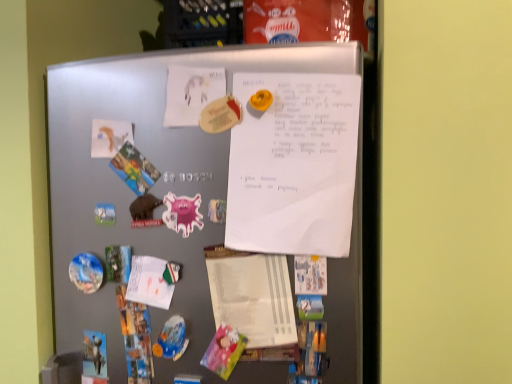
What do you see at coordinates (294, 164) in the screenshot? I see `white paper at upper center, the first poster positioned from the right` at bounding box center [294, 164].

This screenshot has height=384, width=512. In order to click on pink glossy magnet at center-left in this screenshot , I will do `click(182, 213)`.

The width and height of the screenshot is (512, 384). Find the location of `white paper notepad at center`. white paper notepad at center is located at coordinates pos(253,297).

You are a GUI agent. You are given a task and a screenshot of the screen. Output one action in this format:
    pyautogui.click(x=<x>, y=<y>)
    Task: Click on the white matte paper at upper left
    
    Given the screenshot: What is the action you would take?
    pyautogui.click(x=110, y=137)

Choose the correct answer: Is matte paper poster at upper center, the 2th poster when ordered from right to left, inside pink glossy magnet at center-left or outside it?

matte paper poster at upper center, the 2th poster when ordered from right to left, is located beyond the bounds of pink glossy magnet at center-left.

Does matte paper poster at upper center, the 2th poster when ordered from right to left, come in front of pink glossy magnet at center-left?

Yes, it is in front of pink glossy magnet at center-left.

Based on their positions, is matte paper poster at upper center, the 2th poster when ordered from right to left, located to the left or right of pink glossy magnet at center-left?

Based on their positions, matte paper poster at upper center, the 2th poster when ordered from right to left, is located to the right of pink glossy magnet at center-left.

Is matte paper poster at upper center, the 2th poster when ordered from right to left, positioned far away from pink glossy magnet at center-left?

No, matte paper poster at upper center, the 2th poster when ordered from right to left, is not far away from pink glossy magnet at center-left.

From the image's perspective, is pink glossy magnet at center-left above or below white paper notepad at center?

Clearly, from the image's perspective, pink glossy magnet at center-left is above white paper notepad at center.

Is pink glossy magnet at center-left inside or outside of white paper notepad at center?

pink glossy magnet at center-left is spatially situated outside white paper notepad at center.

Consider the image. Is pink glossy magnet at center-left next to white paper notepad at center?

There is a gap between pink glossy magnet at center-left and white paper notepad at center.

Is pink glossy magnet at center-left thinner than white paper notepad at center?

Correct, the width of pink glossy magnet at center-left is less than that of white paper notepad at center.

Considering the relative sizes of matte paper poster at upper center, the 2th poster when ordered from right to left, and white paper at upper center, placed as the 2th poster when sorted from left to right, in the image provided, is matte paper poster at upper center, the 2th poster when ordered from right to left, thinner than white paper at upper center, placed as the 2th poster when sorted from left to right,?

Yes.

Considering the sizes of matte paper poster at upper center, positioned as the 1th poster in left-to-right order, and white paper at upper center, the first poster positioned from the right, in the image, is matte paper poster at upper center, positioned as the 1th poster in left-to-right order, taller or shorter than white paper at upper center, the first poster positioned from the right,?

Clearly, matte paper poster at upper center, positioned as the 1th poster in left-to-right order, is shorter compared to white paper at upper center, the first poster positioned from the right.

The height and width of the screenshot is (384, 512). In order to click on poster that is in front of the matte paper poster at upper center, positioned as the 1th poster in left-to-right order in this screenshot , I will do `click(294, 164)`.

Are satin silver refrigerator at center and matte paper poster at upper center, positioned as the 1th poster in left-to-right order, making contact?

→ No, satin silver refrigerator at center is not beside matte paper poster at upper center, positioned as the 1th poster in left-to-right order.

From the image's perspective, which one is positioned higher, satin silver refrigerator at center or matte paper poster at upper center, positioned as the 1th poster in left-to-right order?

matte paper poster at upper center, positioned as the 1th poster in left-to-right order, appears higher in the image.

Between satin silver refrigerator at center and matte paper poster at upper center, the 2th poster when ordered from right to left, which one has larger size?

satin silver refrigerator at center.

What's the angular difference between satin silver refrigerator at center and matte paper poster at upper center, positioned as the 1th poster in left-to-right order,'s facing directions?

The facing directions of satin silver refrigerator at center and matte paper poster at upper center, positioned as the 1th poster in left-to-right order, are 0.899 degrees apart.

Does white paper notepad at center lie behind pink glossy magnet at center-left?

No, white paper notepad at center is closer to the viewer.

Which is more to the left, white paper notepad at center or pink glossy magnet at center-left?

pink glossy magnet at center-left.

Considering the sizes of white paper notepad at center and pink glossy magnet at center-left in the image, is white paper notepad at center taller or shorter than pink glossy magnet at center-left?

In the image, white paper notepad at center appears to be taller than pink glossy magnet at center-left.

Between white paper at upper center, the first poster positioned from the right, and satin silver refrigerator at center, which one is positioned behind?

white paper at upper center, the first poster positioned from the right, is further from the camera.

Which of these two, white paper at upper center, placed as the 2th poster when sorted from left to right, or satin silver refrigerator at center, is wider?

satin silver refrigerator at center is wider.

Does white paper at upper center, the first poster positioned from the right, touch satin silver refrigerator at center?

white paper at upper center, the first poster positioned from the right, and satin silver refrigerator at center are clearly separated.

Is white paper at upper center, placed as the 2th poster when sorted from left to right, surrounding satin silver refrigerator at center?

No, satin silver refrigerator at center is not inside white paper at upper center, placed as the 2th poster when sorted from left to right.

Is white matte paper at upper left looking in the opposite direction of white paper at upper center, placed as the 2th poster when sorted from left to right?

No, white matte paper at upper left is not facing away from white paper at upper center, placed as the 2th poster when sorted from left to right.

Between white matte paper at upper left and white paper at upper center, placed as the 2th poster when sorted from left to right, which one is positioned in front?

white paper at upper center, placed as the 2th poster when sorted from left to right, is in front.

From the image's perspective, is white matte paper at upper left on top of white paper at upper center, placed as the 2th poster when sorted from left to right?

Yes, from the image's perspective, white matte paper at upper left is on top of white paper at upper center, placed as the 2th poster when sorted from left to right.

Where is `art on the left of matte paper poster at upper center, positioned as the 1th poster in left-to-right order`? art on the left of matte paper poster at upper center, positioned as the 1th poster in left-to-right order is located at coordinates (182, 213).

You are a GUI agent. You are given a task and a screenshot of the screen. Output one action in this format:
    pyautogui.click(x=<x>, y=<y>)
    Task: Click on the art above the white paper notepad at center (from a real-world perspective)
    
    Given the screenshot: What is the action you would take?
    pyautogui.click(x=182, y=213)

Based on their spatial positions, is white paper notepad at center or matte paper poster at upper center, the 2th poster when ordered from right to left, closer to white paper at upper center, placed as the 2th poster when sorted from left to right?

white paper notepad at center lies closer to white paper at upper center, placed as the 2th poster when sorted from left to right, than the other object.

Based on their spatial positions, is white matte paper at upper left or pink glossy magnet at center-left further from white paper notepad at center?

white matte paper at upper left lies further to white paper notepad at center than the other object.

Based on their spatial positions, is satin silver refrigerator at center or matte paper poster at upper center, the 2th poster when ordered from right to left, further from white paper at upper center, placed as the 2th poster when sorted from left to right?

matte paper poster at upper center, the 2th poster when ordered from right to left, lies further to white paper at upper center, placed as the 2th poster when sorted from left to right, than the other object.

When comparing their distances from matte paper poster at upper center, the 2th poster when ordered from right to left, does white paper notepad at center or pink glossy magnet at center-left seem closer?

pink glossy magnet at center-left is positioned closer to the anchor matte paper poster at upper center, the 2th poster when ordered from right to left.

Estimate the real-world distances between objects in this image. Which object is closer to satin silver refrigerator at center, matte paper poster at upper center, the 2th poster when ordered from right to left, or white paper at upper center, the first poster positioned from the right?

white paper at upper center, the first poster positioned from the right.

Considering their positions, is matte paper poster at upper center, positioned as the 1th poster in left-to-right order, positioned further to pink glossy magnet at center-left than white matte paper at upper left?

matte paper poster at upper center, positioned as the 1th poster in left-to-right order, lies further to pink glossy magnet at center-left than the other object.

Based on the photo, estimate the real-world distances between objects in this image. Which object is further from satin silver refrigerator at center, white paper at upper center, the first poster positioned from the right, or white paper notepad at center?

Among the two, white paper notepad at center is located further to satin silver refrigerator at center.

Looking at the image, which one is located further to white matte paper at upper left, pink glossy magnet at center-left or matte paper poster at upper center, positioned as the 1th poster in left-to-right order?

The object further to white matte paper at upper left is pink glossy magnet at center-left.

Where is `poster situated between white matte paper at upper left and white paper at upper center, placed as the 2th poster when sorted from left to right, from left to right`? The width and height of the screenshot is (512, 384). poster situated between white matte paper at upper left and white paper at upper center, placed as the 2th poster when sorted from left to right, from left to right is located at coordinates (191, 93).

Locate an element on the screen. The height and width of the screenshot is (384, 512). poster between matte paper poster at upper center, positioned as the 1th poster in left-to-right order, and pink glossy magnet at center-left from top to bottom is located at coordinates (294, 164).

Find the location of a particular element. The image size is (512, 384). art between white matte paper at upper left and satin silver refrigerator at center from top to bottom is located at coordinates (182, 213).

At what (x,y) coordinates should I click in order to perform the action: click on poster between matte paper poster at upper center, the 2th poster when ordered from right to left, and white paper notepad at center in the up-down direction. Please return your answer as a coordinate pair (x, y). This screenshot has height=384, width=512. Looking at the image, I should click on (294, 164).